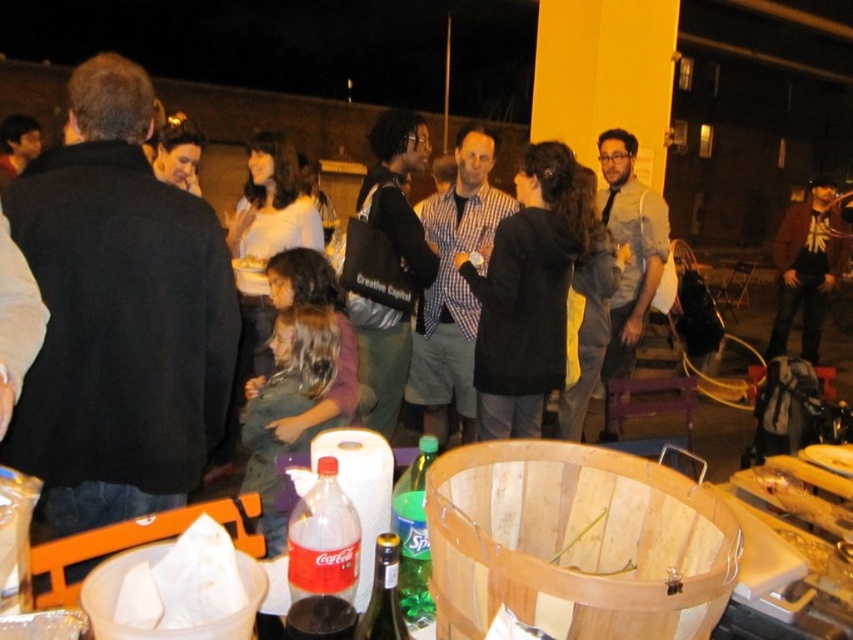
You are standing at the location of the viewer and want to grab the brown leather jacket at right. Is the jacket within your immediate reach?

The brown leather jacket at right is 20.17 feet away from the viewer, which is too far to reach immediately. You would need to move closer to get it.

You are at a nighttime gathering near a brick wall and a yellow pillar. You see two points marked in the image, one at coordinates point (41, 452) and another at point (399, 544). Which of these two points is closer to you?

Point (41, 452) is closer to you because it is further to the viewer than point (399, 544).

You are at a party and need to decide which item to pick up first. The brown leather jacket at right is on a chair, and the translucent plastic bottle at lower center is on the ground. If you want to grab the item that takes up more space, which one should you choose?

The brown leather jacket at right is bigger than the translucent plastic bottle at lower center, so you should choose the brown leather jacket at right since it takes up more space.